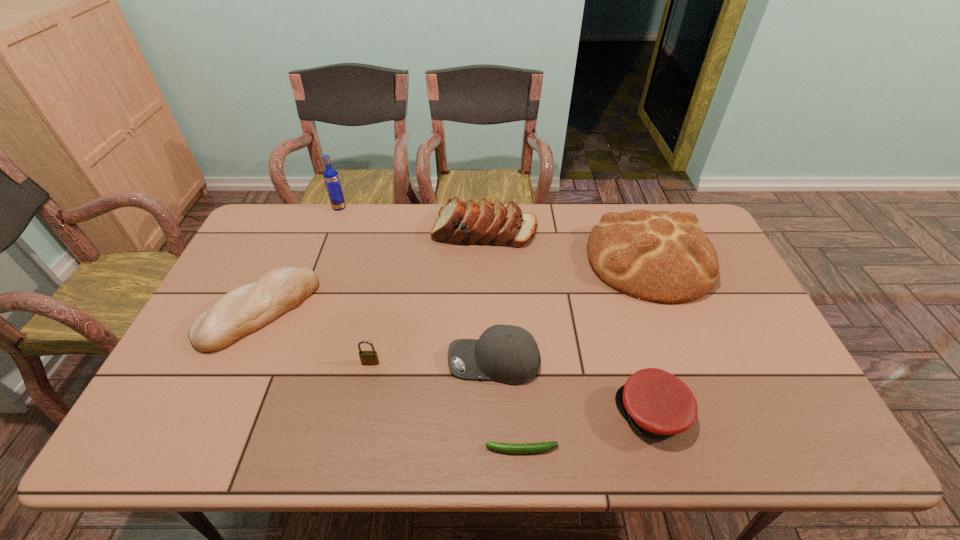
At what (x,y) coordinates should I click in order to perform the action: click on the farthest object. Please return your answer as a coordinate pair (x, y). This screenshot has height=540, width=960. Looking at the image, I should click on (330, 175).

This screenshot has height=540, width=960. What are the coordinates of `vodka` in the screenshot? It's located at (330, 175).

Locate an element on the screen. The height and width of the screenshot is (540, 960). the tallest bread is located at coordinates (661, 256).

Find the location of `the rightmost bread`. the rightmost bread is located at coordinates coord(661,256).

The height and width of the screenshot is (540, 960). Find the location of `the second bread from left to right`. the second bread from left to right is located at coordinates (458, 222).

Locate an element on the screen. This screenshot has height=540, width=960. baseball cap is located at coordinates (509, 354).

Where is `the sixth object from right to left`? the sixth object from right to left is located at coordinates (367, 357).

The height and width of the screenshot is (540, 960). What are the coordinates of `the shortest bread` in the screenshot? It's located at (247, 308).

Where is `cap`? cap is located at coordinates (657, 403).

The image size is (960, 540). What are the coordinates of `the shortest object` in the screenshot? It's located at (519, 448).